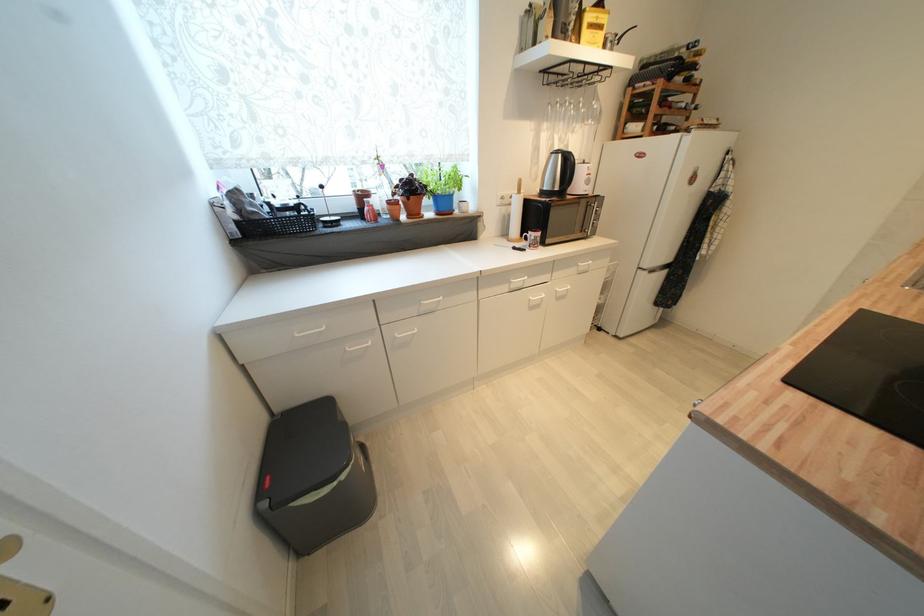
Where would you press the trash can lid button? Please return your answer as a coordinate pair (x, y).

(313, 477)